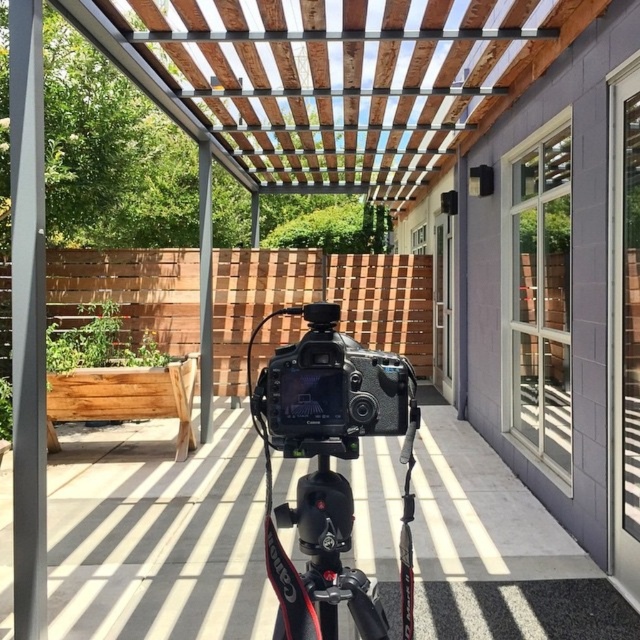
Question: Which of these objects is positioned farthest from the black matte tripod at center?

Choices:
 (A) matte black camera at center
 (B) smooth gray pole at left
 (C) black matte camera at center

Answer: (C)

Question: Observing the image, what is the correct spatial positioning of smooth gray pole at left in reference to black matte tripod at center?

Choices:
 (A) left
 (B) right

Answer: (A)

Question: Does black matte camera at center come in front of black matte tripod at center?

Choices:
 (A) yes
 (B) no

Answer: (B)

Question: Which point is closer to the camera taking this photo?

Choices:
 (A) (372, 586)
 (B) (556, 532)

Answer: (A)

Question: Among these objects, which one is farthest from the camera?

Choices:
 (A) smooth gray pole at left
 (B) black matte tripod at center

Answer: (A)

Question: In this image, where is matte black camera at center located relative to black matte camera at center?

Choices:
 (A) left
 (B) right

Answer: (B)